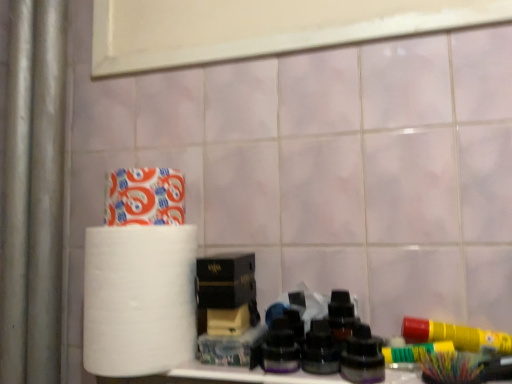
Question: From the image's perspective, is black matte box at center on top of white matte paper towel at left?

Choices:
 (A) yes
 (B) no

Answer: (A)

Question: From a real-world perspective, is black matte box at center located higher than white matte paper towel at left?

Choices:
 (A) no
 (B) yes

Answer: (B)

Question: Is black matte box at center in contact with white matte paper towel at left?

Choices:
 (A) no
 (B) yes

Answer: (B)

Question: Is black matte box at center thinner than white matte paper towel at left?

Choices:
 (A) no
 (B) yes

Answer: (B)

Question: Would you consider black matte box at center to be distant from white matte paper towel at left?

Choices:
 (A) no
 (B) yes

Answer: (A)

Question: In terms of size, does white matte toilet paper at upper left appear bigger or smaller than white matte paper towel at left?

Choices:
 (A) small
 (B) big

Answer: (A)

Question: From a real-world perspective, is white matte toilet paper at upper left positioned above or below white matte paper towel at left?

Choices:
 (A) below
 (B) above

Answer: (B)

Question: Considering their positions, is white matte toilet paper at upper left located in front of or behind white matte paper towel at left?

Choices:
 (A) front
 (B) behind

Answer: (B)

Question: Considering the positions of white matte toilet paper at upper left and white matte paper towel at left in the image, is white matte toilet paper at upper left taller or shorter than white matte paper towel at left?

Choices:
 (A) tall
 (B) short

Answer: (B)

Question: Visually, is black matte box at center positioned to the left or to the right of white matte toilet paper at upper left?

Choices:
 (A) left
 (B) right

Answer: (B)

Question: In terms of height, does black matte box at center look taller or shorter compared to white matte toilet paper at upper left?

Choices:
 (A) short
 (B) tall

Answer: (A)

Question: Is black matte box at center spatially inside white matte toilet paper at upper left, or outside of it?

Choices:
 (A) inside
 (B) outside

Answer: (B)

Question: From the image's perspective, relative to white matte toilet paper at upper left, is black matte box at center above or below?

Choices:
 (A) below
 (B) above

Answer: (A)

Question: Would you say black matte box at center is inside or outside white matte paper towel at left?

Choices:
 (A) outside
 (B) inside

Answer: (A)

Question: Is point (210, 264) closer or farther from the camera than point (158, 264)?

Choices:
 (A) closer
 (B) farther

Answer: (B)